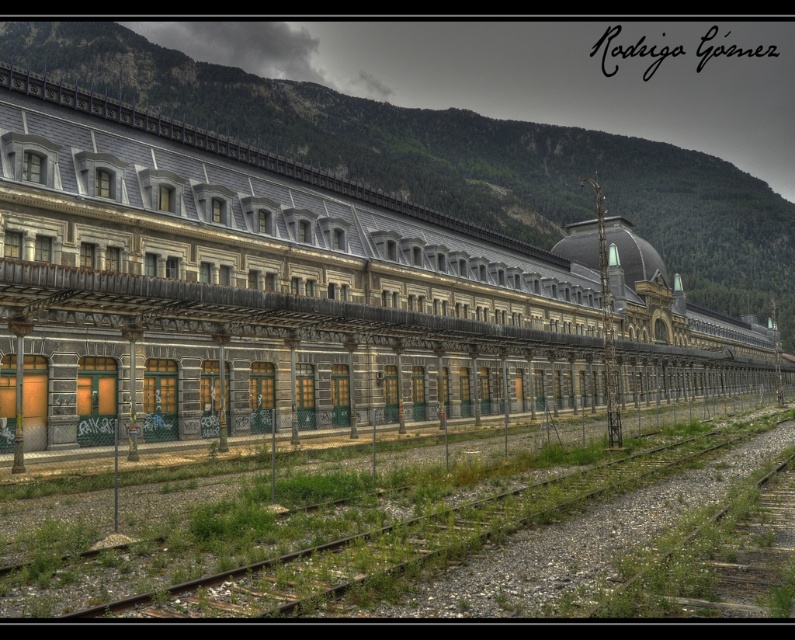
Can you confirm if stone train at center is taller than gravelly metal train track at lower left?

Indeed, stone train at center has a greater height compared to gravelly metal train track at lower left.

Who is shorter, stone train at center or gravelly metal train track at lower left?

gravelly metal train track at lower left

The image size is (795, 640). I want to click on stone train at center, so click(293, 291).

Identify the location of stone train at center. (293, 291).